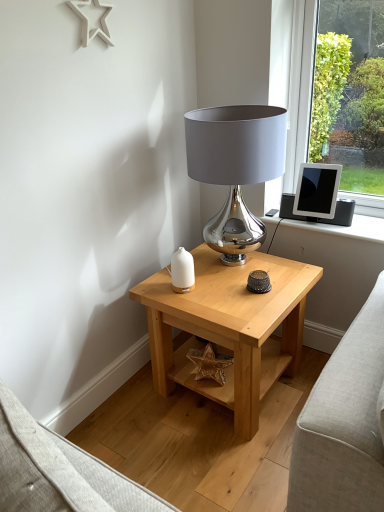
At what (x,y) coordinates should I click in order to perform the action: click on unoccupied region to the right of white glossy vase at center. Please return your answer as a coordinate pair (x, y). Looking at the image, I should click on (218, 289).